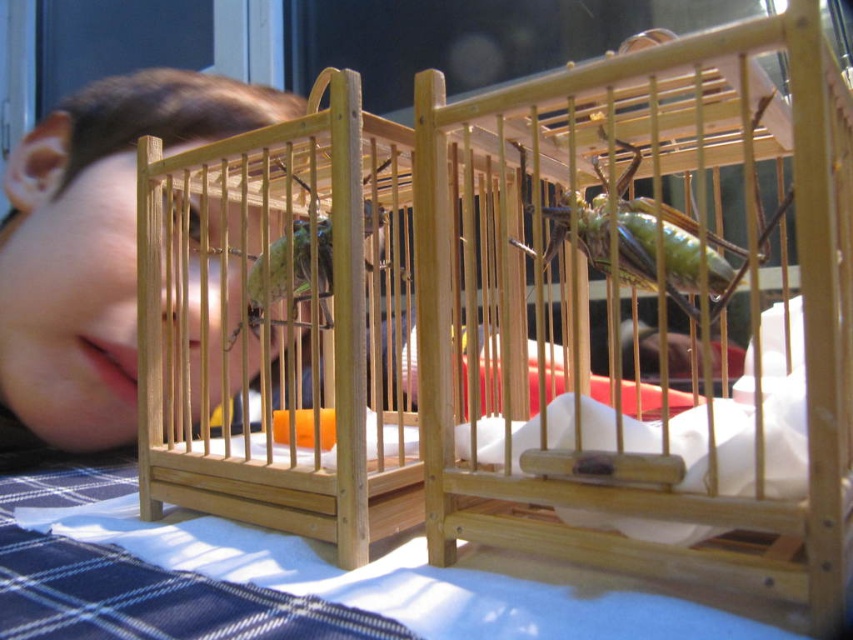
You are a researcher examining the image of two cages with insects. You need to determine which object is bigger between the smooth skin face at upper left and the green matte grasshopper at center. Can you identify the larger one?

The smooth skin face at upper left is larger in size than the green matte grasshopper at center, so the smooth skin face at upper left is bigger.

You are a delivery robot with a width of 80 centimeters. You need to move between the two points marked as point (122, 403). Can you fit through the space between them?

The two points marked as point (122, 403) are 89.28 centimeters apart, so the delivery robot with a width of 80 centimeters can fit through the space between them since 80 cm is less than 89.28 cm.

You are a scientist examining two insects in cages on a table. You notice both the green matte insect at center and the green matte grasshopper at center. Which one has a greater height?

The green matte insect at center is taller than the green matte grasshopper at center.